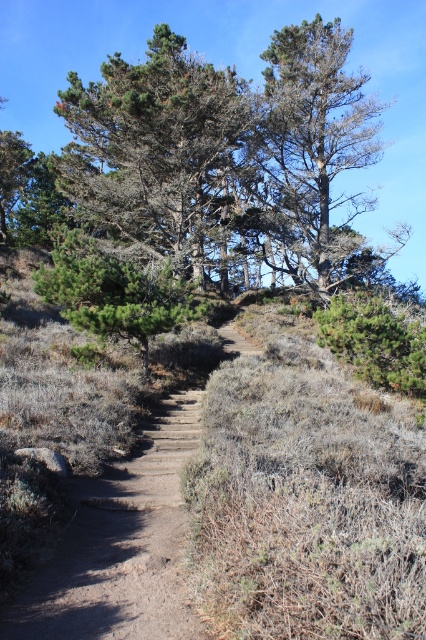
Question: Can you confirm if dirt path at center is positioned to the left of green needle-like tree at center?

Choices:
 (A) no
 (B) yes

Answer: (A)

Question: Can you confirm if green needle-like tree at upper center is positioned above green needle-like tree at center?

Choices:
 (A) yes
 (B) no

Answer: (A)

Question: Which object appears farthest from the camera in this image?

Choices:
 (A) dirt path at center
 (B) green needle-like at upper center
 (C) green needle-like tree at center
 (D) green needle-like tree at upper center

Answer: (B)

Question: Which point is farther to the camera?

Choices:
 (A) (75, 301)
 (B) (222, 252)

Answer: (B)

Question: Which of the following is the closest to the observer?

Choices:
 (A) dirt path at center
 (B) green needle-like tree at center

Answer: (A)

Question: Can you confirm if dirt path at center is bigger than green needle-like tree at center?

Choices:
 (A) no
 (B) yes

Answer: (A)